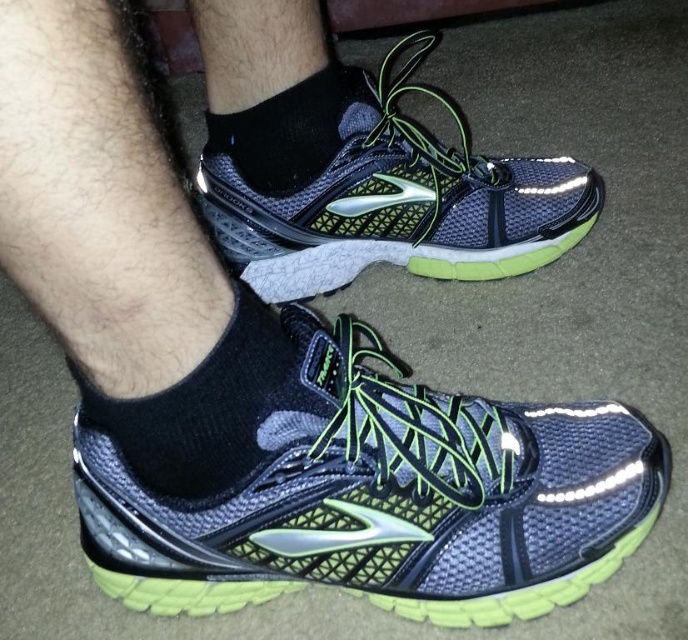
Question: Where is matte mesh shoe at center located in relation to black mesh sock at lower center in the image?

Choices:
 (A) above
 (B) below

Answer: (B)

Question: Which point is closer to the camera?

Choices:
 (A) matte mesh shoe at center
 (B) matte mesh running shoe at center
 (C) black mesh sock at center
 (D) black mesh sock at lower center

Answer: (D)

Question: Is black mesh sock at lower center positioned behind black mesh sock at center?

Choices:
 (A) no
 (B) yes

Answer: (A)

Question: Among these points, which one is farthest from the camera?

Choices:
 (A) (516, 236)
 (B) (214, 416)
 (C) (506, 545)
 (D) (239, 168)

Answer: (A)

Question: Is black mesh sock at lower center smaller than black mesh sock at center?

Choices:
 (A) yes
 (B) no

Answer: (B)

Question: Based on their relative distances, which object is nearer to the black mesh sock at center?

Choices:
 (A) matte mesh running shoe at center
 (B) black mesh sock at lower center
 (C) matte mesh shoe at center

Answer: (A)